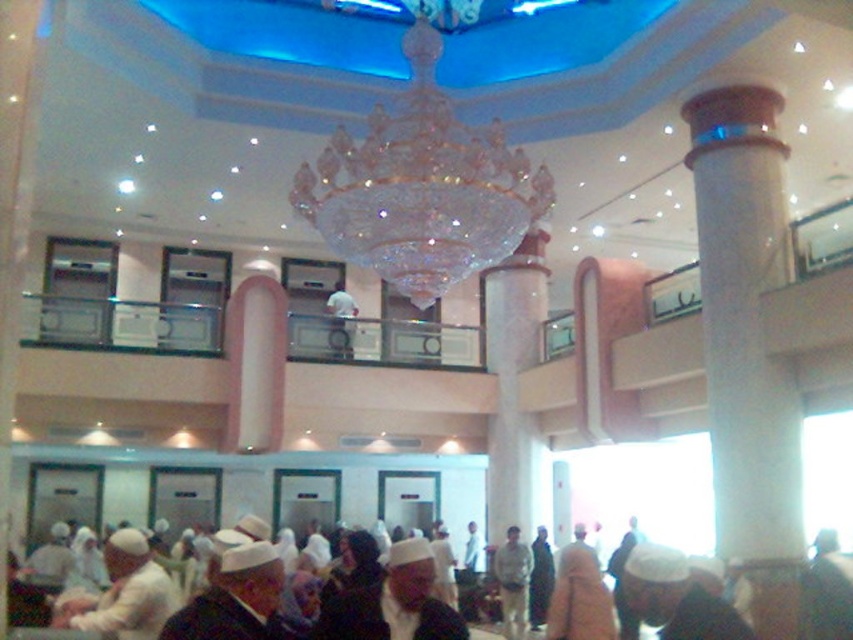
In the scene shown: You are an interior designer planning to install a new lighting fixture in this building. You have a design that requires the space above the current crystal glass chandelier at center to be wider than the white fabric hat at center. Based on the scene, is this requirement met?

The crystal glass chandelier at center is wider than the white fabric hat at center, so the requirement is met.